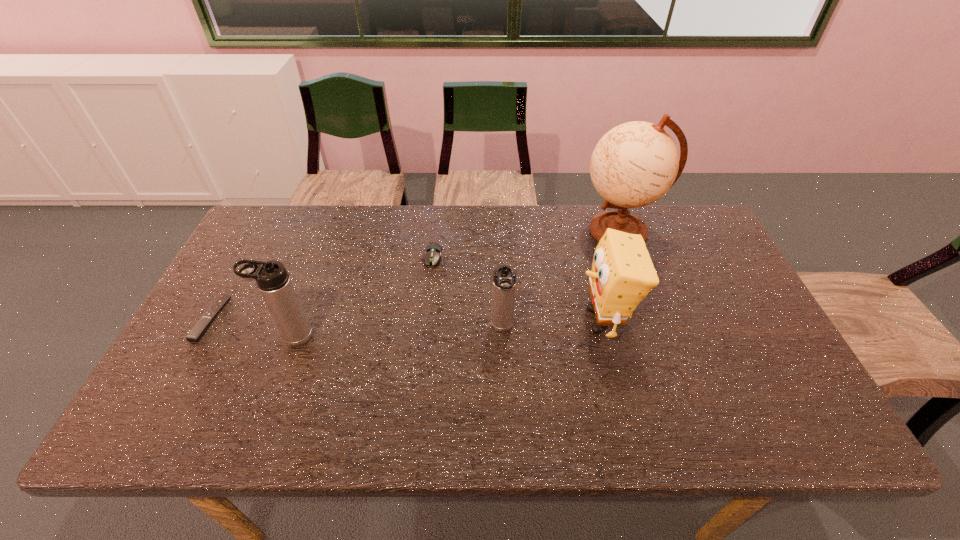
In the current image, all thermos bottles are evenly spaced. To maintain this equal spacing, where should an additional thermos bottle be placed on the right? Please point out a free spot. Please provide its 2D coordinates. Your answer should be formatted as a tuple, i.e. [(x, y)], where the tuple contains the x and y coordinates of a point satisfying the conditions above.

[(707, 321)]